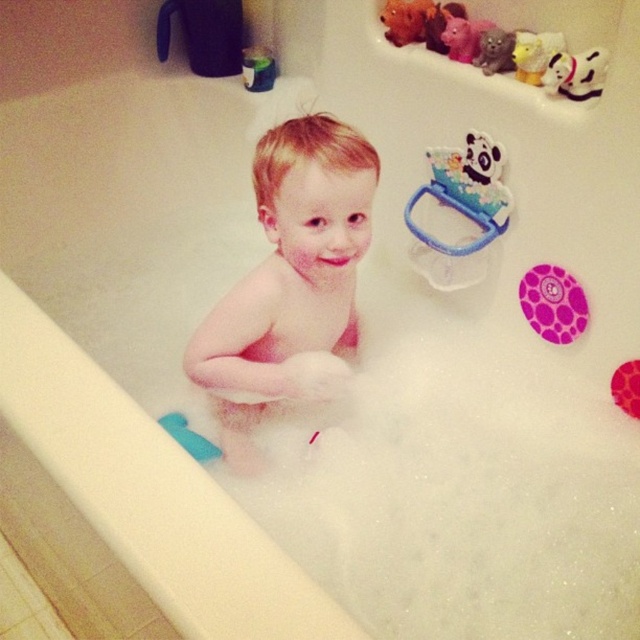
Question: Which is nearer to the white rubber duck at upper right?

Choices:
 (A) white plastic panda at upper center
 (B) purple dotted rubber ring at upper right
 (C) pink matte toddler at center

Answer: (A)

Question: Does purple dotted rubber ring at upper right have a smaller size compared to white plastic panda at upper center?

Choices:
 (A) yes
 (B) no

Answer: (B)

Question: Is white rubber duck at upper right bigger than white plastic panda at upper center?

Choices:
 (A) no
 (B) yes

Answer: (B)

Question: Which object appears closest to the camera in this image?

Choices:
 (A) white plastic panda at upper center
 (B) pink dotted rubber at upper right
 (C) purple dotted rubber ring at upper right
 (D) white rubber duck at upper right

Answer: (D)

Question: Estimate the real-world distances between objects in this image. Which object is closer to the pink dotted rubber at upper right?

Choices:
 (A) white rubber duck at upper right
 (B) pink matte toddler at center

Answer: (A)

Question: Is pink matte toddler at center below pink dotted rubber at upper right?

Choices:
 (A) no
 (B) yes

Answer: (A)